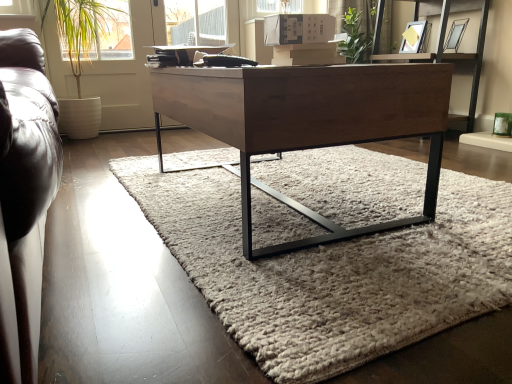
Question: Visually, is green leafy plant at left positioned to the left or to the right of wooden desk at center?

Choices:
 (A) right
 (B) left

Answer: (B)

Question: Does point (103, 8) appear closer or farther from the camera than point (423, 119)?

Choices:
 (A) farther
 (B) closer

Answer: (A)

Question: Estimate the real-world distances between objects in this image. Which object is closer to the wooden shelf at upper center?

Choices:
 (A) soft gray wool rug at center
 (B) green leafy plant at left
 (C) wooden desk at center

Answer: (A)

Question: Which object is positioned farthest from the soft gray wool rug at center?

Choices:
 (A) green leafy plant at left
 (B) wooden shelf at upper center
 (C) wooden desk at center

Answer: (A)